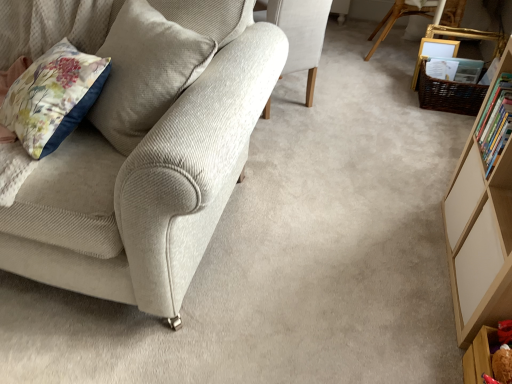
Question: Does wooden picture frame at upper right have a larger size compared to light beige fabric chair at center, which appears as the 2th chair when viewed from the back?

Choices:
 (A) no
 (B) yes

Answer: (A)

Question: Is wooden picture frame at upper right not close to light beige fabric chair at center, placed as the second chair when sorted from front to back?

Choices:
 (A) no
 (B) yes

Answer: (A)

Question: Considering the relative positions of wooden picture frame at upper right and light beige fabric chair at center, the second chair in the right-to-left sequence, in the image provided, is wooden picture frame at upper right behind light beige fabric chair at center, the second chair in the right-to-left sequence,?

Choices:
 (A) yes
 (B) no

Answer: (A)

Question: Does wooden picture frame at upper right have a lesser height compared to light beige fabric chair at center, the second chair in the right-to-left sequence?

Choices:
 (A) yes
 (B) no

Answer: (A)

Question: Considering the relative positions of wooden picture frame at upper right and light beige fabric chair at center, which appears as the 2th chair when viewed from the back, in the image provided, is wooden picture frame at upper right in front of light beige fabric chair at center, which appears as the 2th chair when viewed from the back,?

Choices:
 (A) yes
 (B) no

Answer: (B)

Question: Considering the relative positions of wooden picture frame at upper right and light beige corduroy chair at left, the first chair from the left, in the image provided, is wooden picture frame at upper right to the left or to the right of light beige corduroy chair at left, the first chair from the left,?

Choices:
 (A) left
 (B) right

Answer: (B)

Question: Considering their positions, is wooden picture frame at upper right located in front of or behind light beige corduroy chair at left, marked as the 3th chair in a back-to-front arrangement?

Choices:
 (A) front
 (B) behind

Answer: (B)

Question: From the image's perspective, is wooden picture frame at upper right positioned above or below light beige corduroy chair at left, the 3th chair from the right?

Choices:
 (A) above
 (B) below

Answer: (A)

Question: Does point (431, 41) appear closer or farther from the camera than point (122, 215)?

Choices:
 (A) closer
 (B) farther

Answer: (B)

Question: Is point (475, 337) closer or farther from the camera than point (152, 269)?

Choices:
 (A) farther
 (B) closer

Answer: (A)

Question: Is wooden shelf at lower right to the left or to the right of light beige corduroy chair at left, acting as the 1th chair starting from the front, in the image?

Choices:
 (A) right
 (B) left

Answer: (A)

Question: From the image's perspective, is wooden shelf at lower right above or below light beige corduroy chair at left, the first chair from the left?

Choices:
 (A) below
 (B) above

Answer: (A)

Question: From a real-world perspective, is wooden shelf at lower right physically located above or below light beige corduroy chair at left, the first chair from the left?

Choices:
 (A) below
 (B) above

Answer: (A)

Question: In terms of width, does light wood bookcase at right look wider or thinner when compared to wooden chair at upper center, which is the 1th chair from right to left?

Choices:
 (A) wide
 (B) thin

Answer: (B)

Question: From the image's perspective, relative to wooden chair at upper center, which is the 3th chair from left to right, is light wood bookcase at right above or below?

Choices:
 (A) above
 (B) below

Answer: (B)